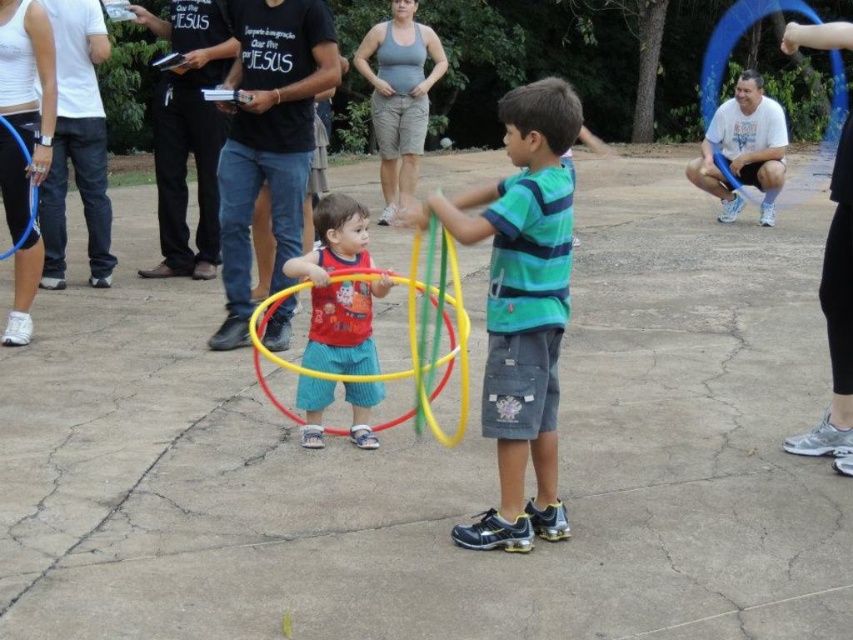
Question: Can you confirm if green striped shirt at center is positioned to the right of white cotton shirt at right?

Choices:
 (A) yes
 (B) no

Answer: (B)

Question: Can you confirm if matte red hula hoop at center is positioned below white cotton shirt at right?

Choices:
 (A) no
 (B) yes

Answer: (B)

Question: Which point appears farthest from the camera in this image?

Choices:
 (A) (538, 532)
 (B) (270, 400)
 (C) (335, 284)
 (D) (782, 116)

Answer: (D)

Question: Which object is positioned closest to the matte red hula hoop at center?

Choices:
 (A) white cotton shirt at right
 (B) green striped shirt at center

Answer: (B)

Question: Which of the following is the closest to the observer?

Choices:
 (A) (350, 333)
 (B) (524, 289)
 (C) (260, 388)
 (D) (734, 118)

Answer: (B)

Question: From the image, what is the correct spatial relationship of green striped shirt at center in relation to white cotton shirt at right?

Choices:
 (A) below
 (B) above

Answer: (A)